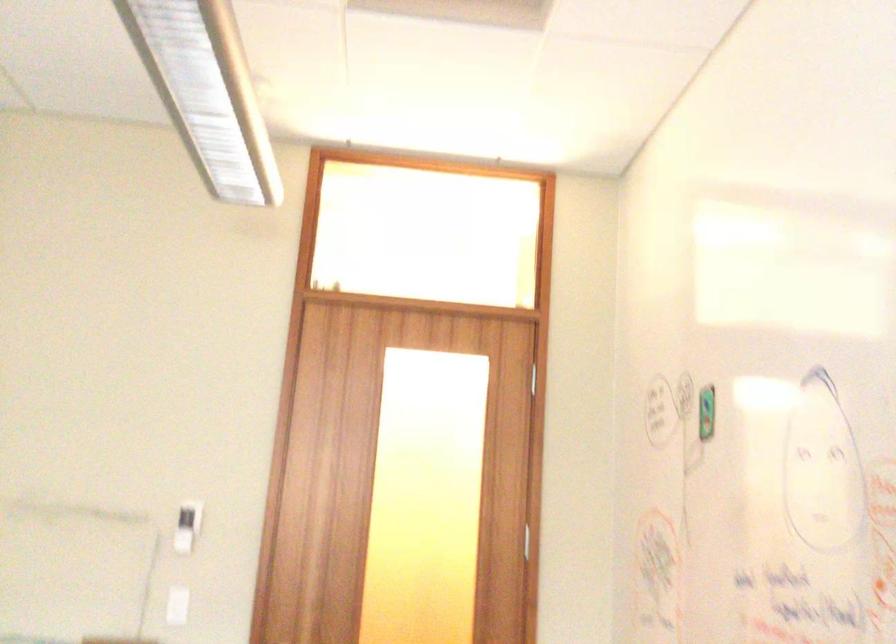
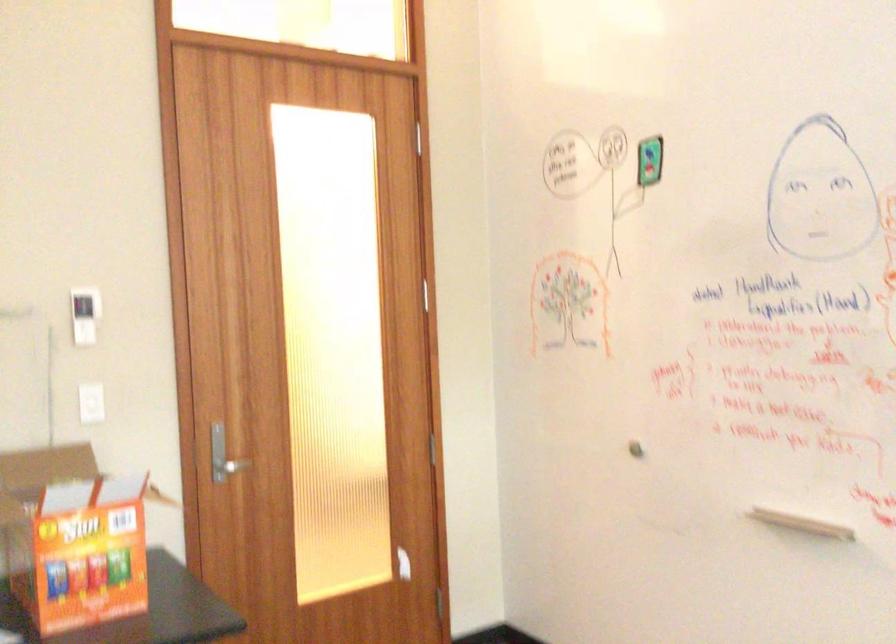
Find the pixel in the second image that matches (184,524) in the first image.

(84, 315)